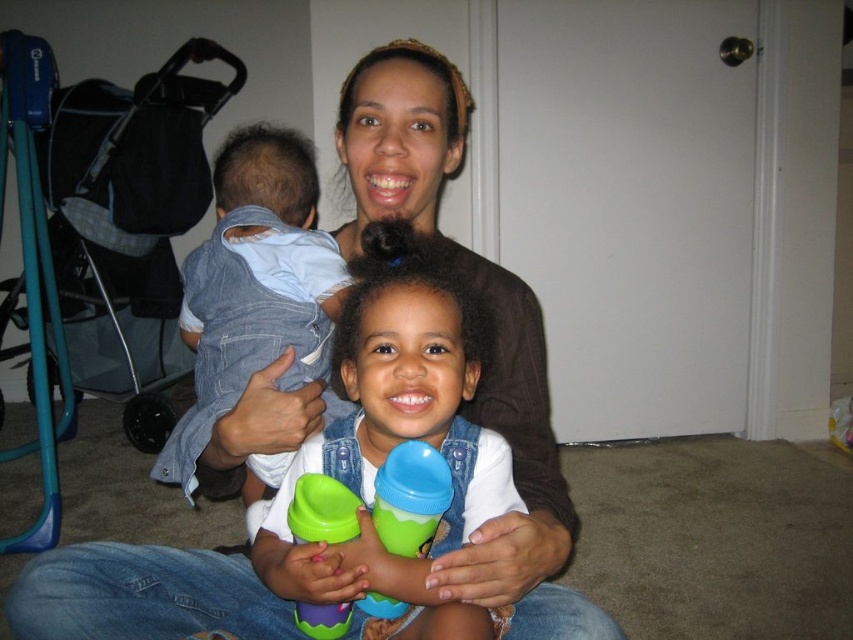
Question: Does matte brown shirt at center have a lesser width compared to green plastic sippy cup at center?

Choices:
 (A) no
 (B) yes

Answer: (A)

Question: Among these points, which one is nearest to the camera?

Choices:
 (A) (410, 545)
 (B) (389, 417)
 (C) (265, 150)

Answer: (A)

Question: Is green plastic sippy cups at center in front of green rubber sippy cup at center?

Choices:
 (A) no
 (B) yes

Answer: (B)

Question: Which object appears farthest from the camera in this image?

Choices:
 (A) denim at left
 (B) green plastic sippy cup at center

Answer: (A)

Question: Which point is closer to the camera?

Choices:
 (A) matte brown shirt at center
 (B) green plastic sippy cups at center
 (C) denim at left
 (D) green rubber sippy cup at center

Answer: (B)

Question: Considering the relative positions of denim at left and green rubber sippy cup at center in the image provided, where is denim at left located with respect to green rubber sippy cup at center?

Choices:
 (A) left
 (B) right

Answer: (A)